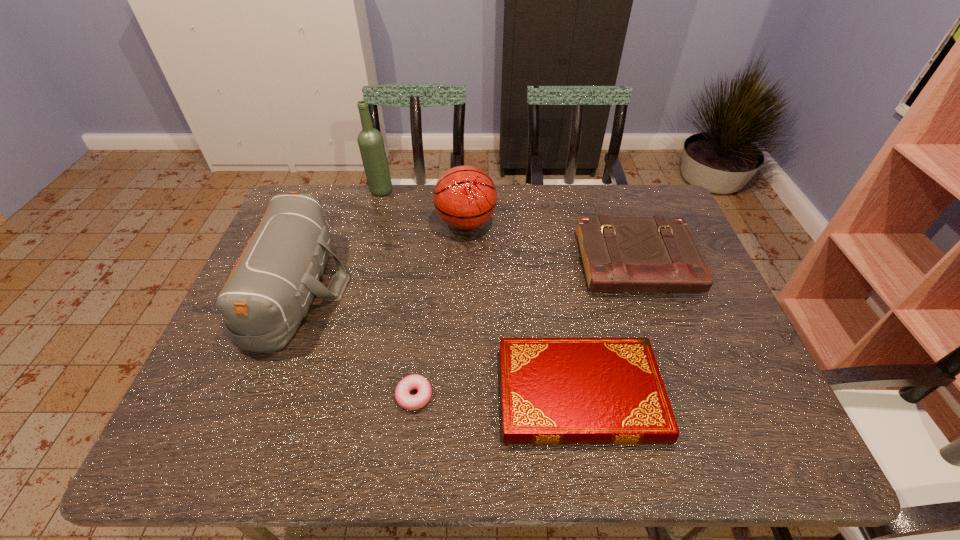
The image size is (960, 540). In order to click on free space located 0.290m on the side with spill of the basketball in this screenshot , I will do tap(588, 223).

Where is `free space located 0.190m on the right of the duffel bag`? This screenshot has height=540, width=960. free space located 0.190m on the right of the duffel bag is located at coordinates (419, 288).

Identify the location of free space located on the front of the taller hardback book. The height and width of the screenshot is (540, 960). (685, 405).

At what (x,y) coordinates should I click in order to perform the action: click on vacant space located 0.290m on the cover of the nearer hardback book. Please return your answer as a coordinate pair (x, y). Looking at the image, I should click on (369, 394).

Where is `free region located on the cover of the nearer hardback book`? This screenshot has width=960, height=540. free region located on the cover of the nearer hardback book is located at coordinates (442, 394).

I want to click on vacant space situated 0.150m on the cover of the nearer hardback book, so click(433, 394).

Where is `blank area located on the back of the shortest object`? This screenshot has height=540, width=960. blank area located on the back of the shortest object is located at coordinates (428, 272).

You are a GUI agent. You are given a task and a screenshot of the screen. Output one action in this format:
    pyautogui.click(x=<x>, y=<y>)
    Task: Click on the wine bottle present at the far edge
    This screenshot has height=540, width=960.
    Given the screenshot: What is the action you would take?
    pyautogui.click(x=370, y=141)

What are the coordinates of `basketball situated at the far edge` in the screenshot? It's located at (465, 197).

You are a GUI agent. You are given a task and a screenshot of the screen. Output one action in this format:
    pyautogui.click(x=<x>, y=<y>)
    Task: Click on the object that is at the near edge
    Image resolution: width=960 pixels, height=540 pixels.
    Given the screenshot: What is the action you would take?
    pyautogui.click(x=553, y=390)